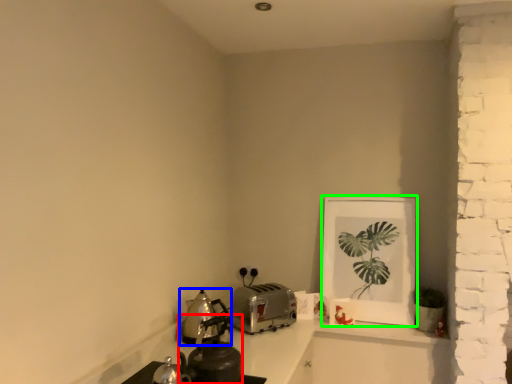
Question: Which object is the closest to the tea pot (highlighted by a red box)? Choose among these: kitchen appliance (highlighted by a blue box) or picture frame (highlighted by a green box).

Choices:
 (A) kitchen appliance
 (B) picture frame

Answer: (A)